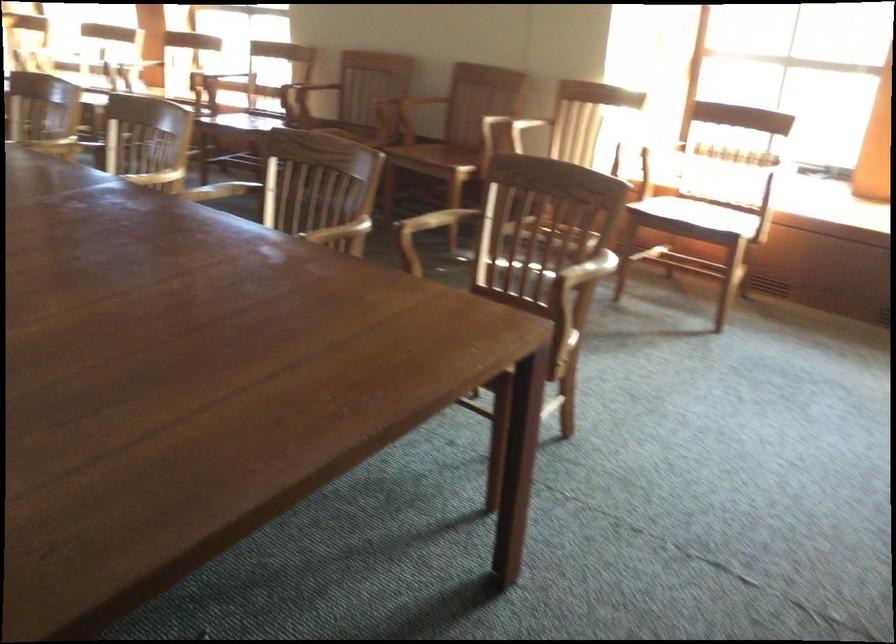
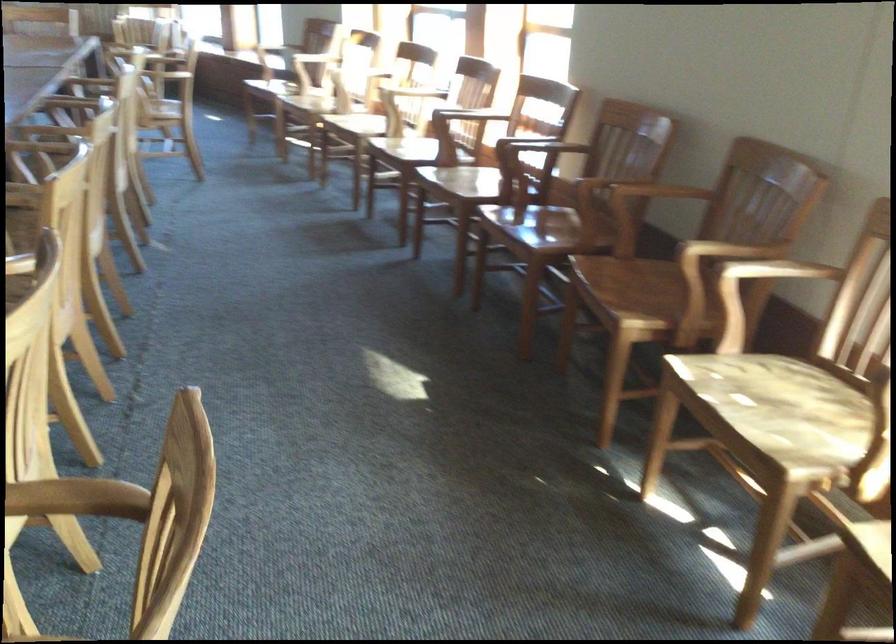
Where in the second image is the point corresponding to point (453, 144) from the first image?

(650, 283)